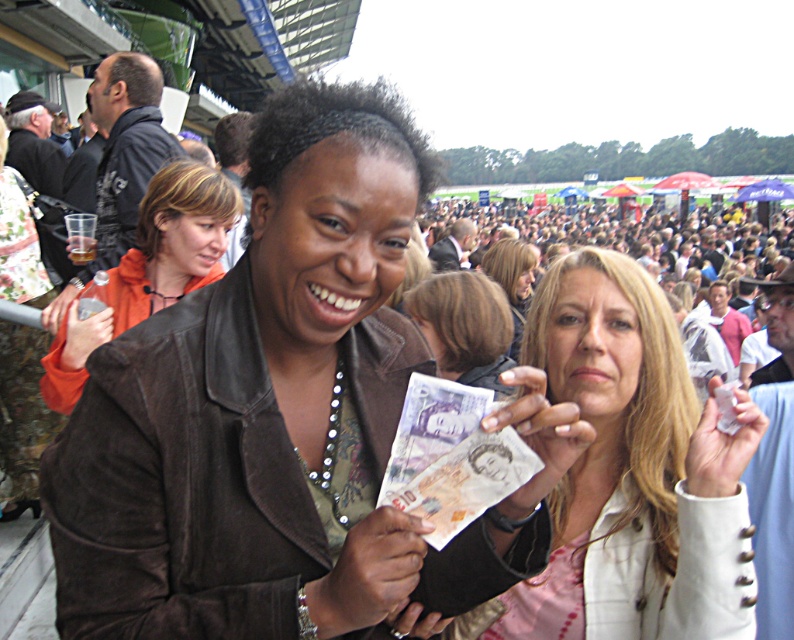
Is purple paper currency at center thinner than blonde hair at center?

Correct, purple paper currency at center's width is less than blonde hair at center's.

Does point (407, 484) lie behind point (503, 282)?

No, it is not.

You are a GUI agent. You are given a task and a screenshot of the screen. Output one action in this format:
    pyautogui.click(x=<x>, y=<y>)
    Task: Click on the purple paper currency at center
    
    Given the screenshot: What is the action you would take?
    pyautogui.click(x=451, y=458)

In the scene shown: Who is higher up, brown leather jacket at center or smooth brown hair at center?

brown leather jacket at center is above.

Is brown leather jacket at center below smooth brown hair at center?

No, brown leather jacket at center is not below smooth brown hair at center.

Which is in front, point (299, 170) or point (484, 356)?

Positioned in front is point (299, 170).

Identify the location of brown leather jacket at center. The image size is (794, 640). (282, 417).

Who is taller, brown leather jacket at center or white textured jacket at center?

With more height is brown leather jacket at center.

How far apart are brown leather jacket at center and white textured jacket at center?

A distance of 27.36 inches exists between brown leather jacket at center and white textured jacket at center.

Locate an element on the screen. This screenshot has width=794, height=640. brown leather jacket at center is located at coordinates (282, 417).

Find the location of a particular element. brown leather jacket at center is located at coordinates (282, 417).